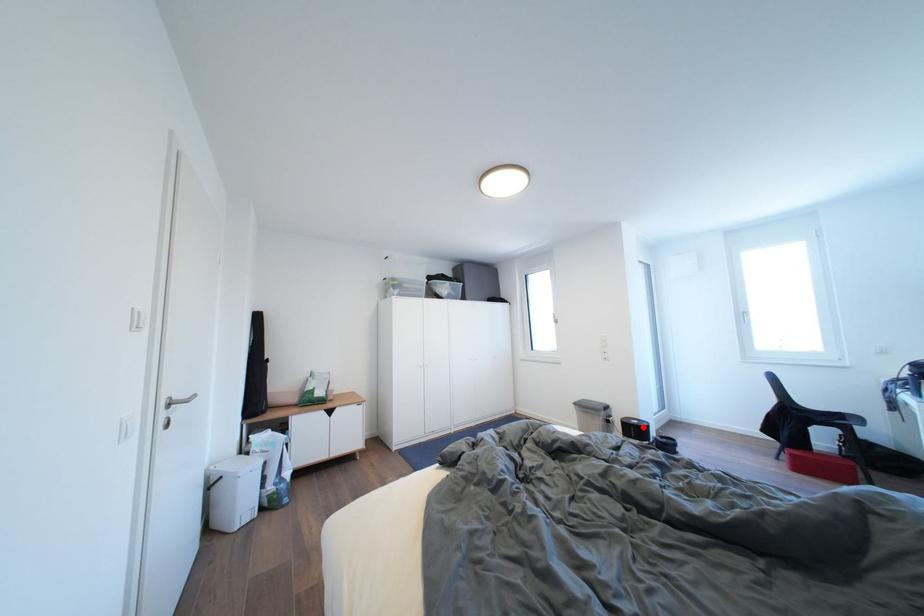
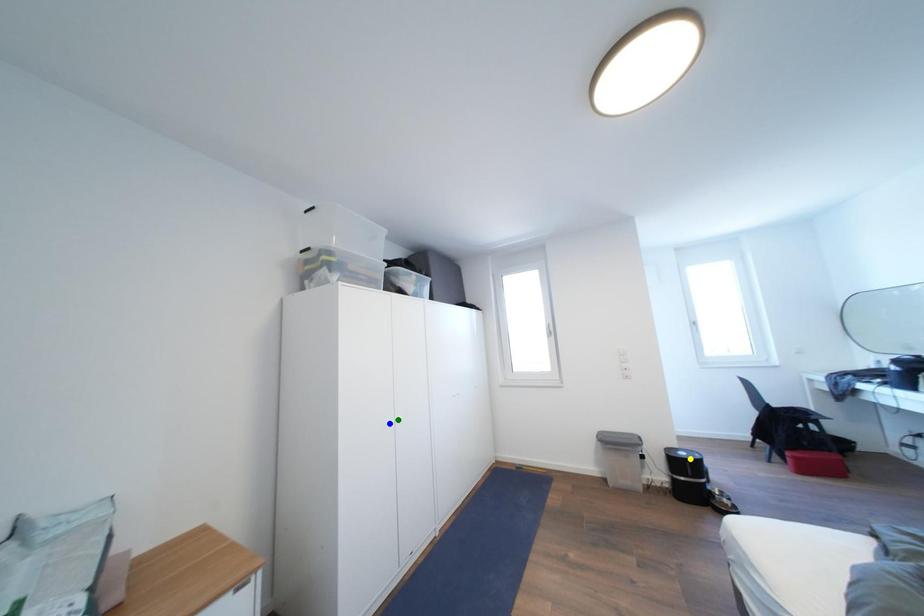
Question: I am providing you with two images of the same scene from different viewpoints. A red point is marked on the first image. You are given multiple points on the second image. Which spot in image 2 lines up with the point in image 1?

Choices:
 (A) yellow point
 (B) blue point
 (C) green point

Answer: (A)